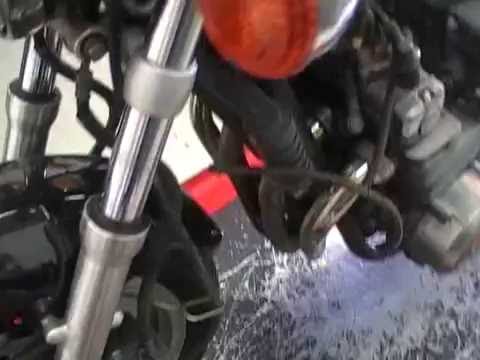
What are the coordinates of `turn light` in the screenshot? It's located at (256, 17).